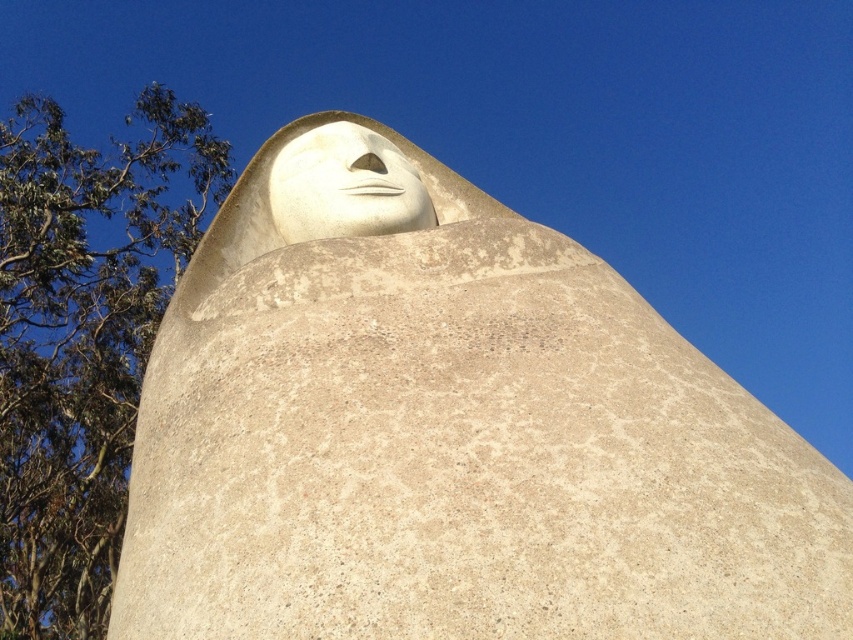
Between white stone face at upper center and matte gray nose at center, which one appears on the left side from the viewer's perspective?

white stone face at upper center is more to the left.

Locate an element on the screen. The width and height of the screenshot is (853, 640). white stone face at upper center is located at coordinates (345, 186).

In order to click on white stone face at upper center in this screenshot , I will do `click(345, 186)`.

Can you confirm if green leafy tree at upper left is shorter than white stone face at upper center?

No.

Does point (99, 387) lie behind point (270, 182)?

Yes, point (99, 387) is behind point (270, 182).

I want to click on green leafy tree at upper left, so click(x=82, y=340).

Where is `green leafy tree at upper left`? green leafy tree at upper left is located at coordinates (82, 340).

Which of these two, white concrete face at upper center or green leafy tree at upper left, stands taller?

Standing taller between the two is green leafy tree at upper left.

Is white concrete face at upper center smaller than green leafy tree at upper left?

Yes.

The width and height of the screenshot is (853, 640). I want to click on white concrete face at upper center, so click(x=450, y=433).